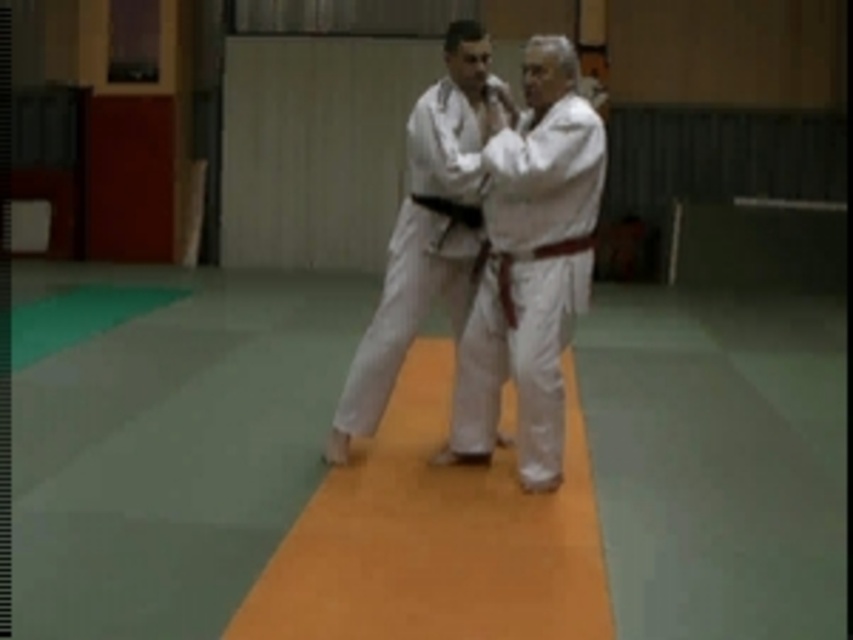
You are a martial arts instructor observing a practice session. You notice the white matte kimono at center and the black leather belt at center. Which item would require more space to properly fold and store?

The white matte kimono at center is larger in size than the black leather belt at center, so it would require more space to properly fold and store.

You are a martial arts instructor observing a training session. You notice the white karate gi at center and the black leather belt at center. Can you determine if the distance between them is sufficient to allow a 6.5 inch wide training mat to fit between the two objects?

The distance between the white karate gi at center and the black leather belt at center is 8.41 inches, which is wider than the 6.5 inch width of the training mat. Therefore, the mat can fit between them.